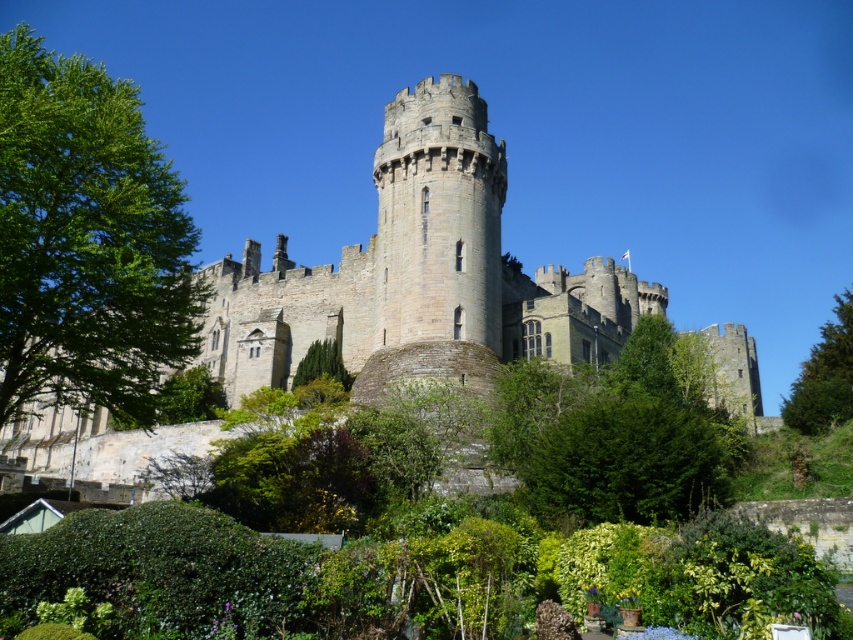
Which is more to the left, green leafy tree at lower right or green textured tree at center?

green textured tree at center is more to the left.

Which is above, green leafy tree at lower right or green textured tree at center?

green textured tree at center

Does point (643, 520) lie behind point (335, 352)?

That is False.

At what (x,y) coordinates should I click in order to perform the action: click on green leafy tree at lower right. Please return your answer as a coordinate pair (x, y). This screenshot has height=640, width=853. Looking at the image, I should click on (619, 432).

Can you confirm if green leafy tree at left is bigger than green leafy hedge at lower center?

Yes, green leafy tree at left is bigger than green leafy hedge at lower center.

Between green leafy tree at left and green leafy hedge at lower center, which one is positioned higher?

Positioned higher is green leafy tree at left.

This screenshot has width=853, height=640. What do you see at coordinates (86, 241) in the screenshot?
I see `green leafy tree at left` at bounding box center [86, 241].

Where is `green leafy tree at left`? The height and width of the screenshot is (640, 853). green leafy tree at left is located at coordinates (86, 241).

Which is in front, point (47, 346) or point (328, 344)?

Point (47, 346)

Can you confirm if green leafy tree at left is bigger than green textured tree at center?

Yes.

Measure the distance between point [90,330] and camera.

A distance of 161.47 feet exists between point [90,330] and camera.

Where is `green leafy tree at left`? The height and width of the screenshot is (640, 853). green leafy tree at left is located at coordinates click(86, 241).